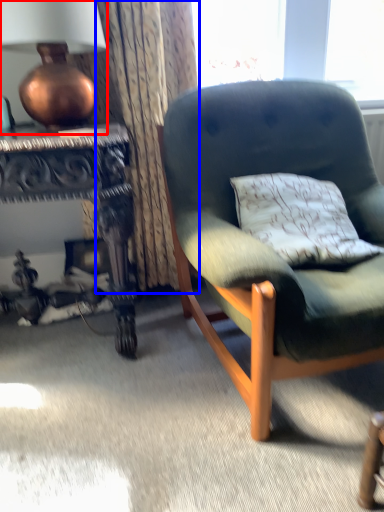
Question: Which of the following is the farthest to the observer, lamp (highlighted by a red box) or curtain (highlighted by a blue box)?

Choices:
 (A) lamp
 (B) curtain

Answer: (B)